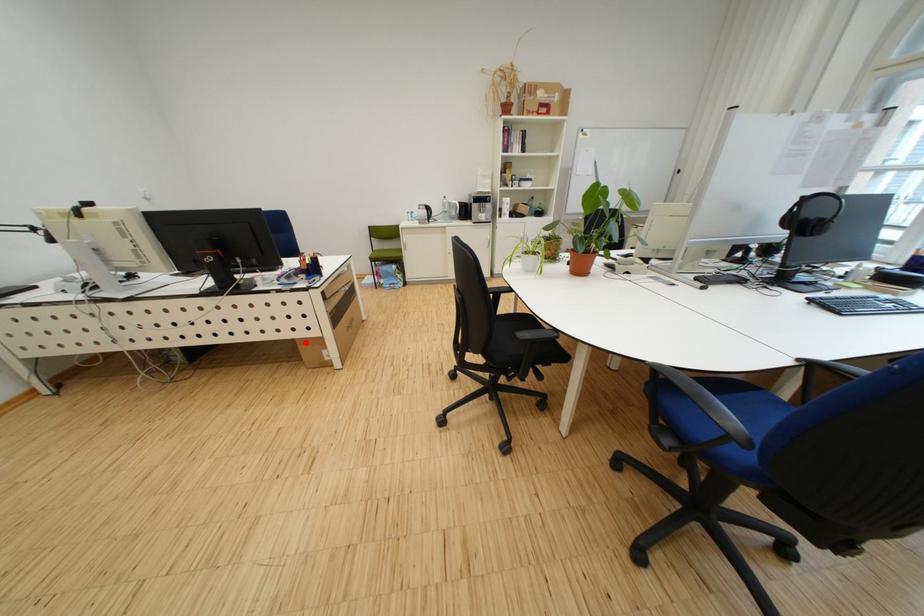
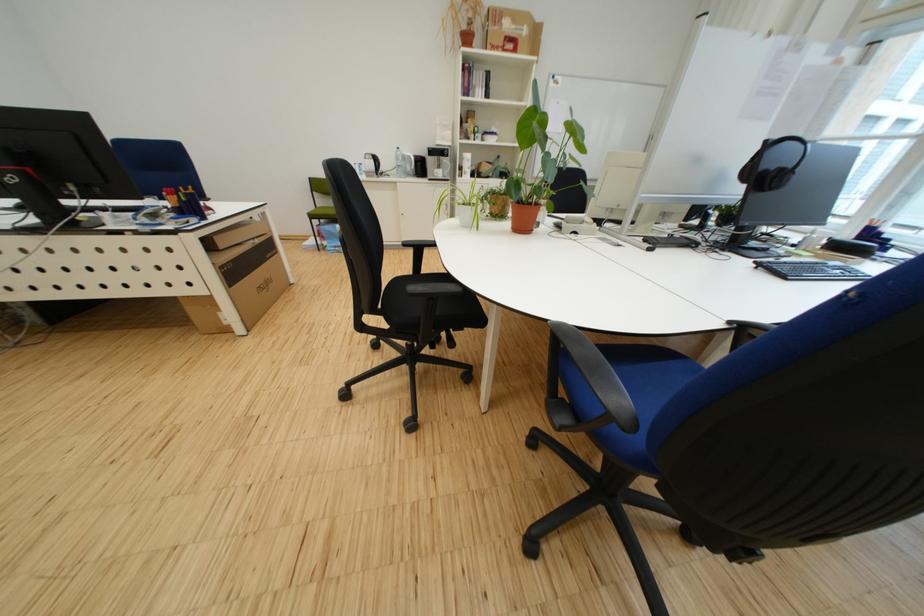
Find the pixel in the second image that matches the highlighted location in the first image.

(186, 301)